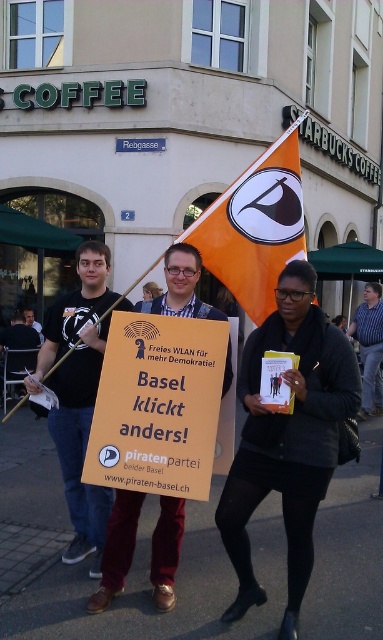
You are a photographer at the protest. You need to capture a photo that includes both the black matte jacket at center and the orange fabric flag at center. Which object should you focus on to ensure both are in frame without moving the camera?

Since the black matte jacket at center is larger in size than the orange fabric flag at center, you should focus on the larger object, the black matte jacket at center, to ensure both are in frame without moving the camera.

You are a photographer trying to capture a photo of the protest. You notice two points in the image at coordinates point (x=207, y=365) and point (x=219, y=211). If you want to focus on the point closer to the camera, which coordinate should you aim your camera at?

Point (x=207, y=365) is closer to the camera, so you should aim your camera at point (x=207, y=365) to focus on the closer point.

What is the location of the point with coordinates (288, 438) in the image?

The point with coordinates (288, 438) is located on the black matte jacket at center.